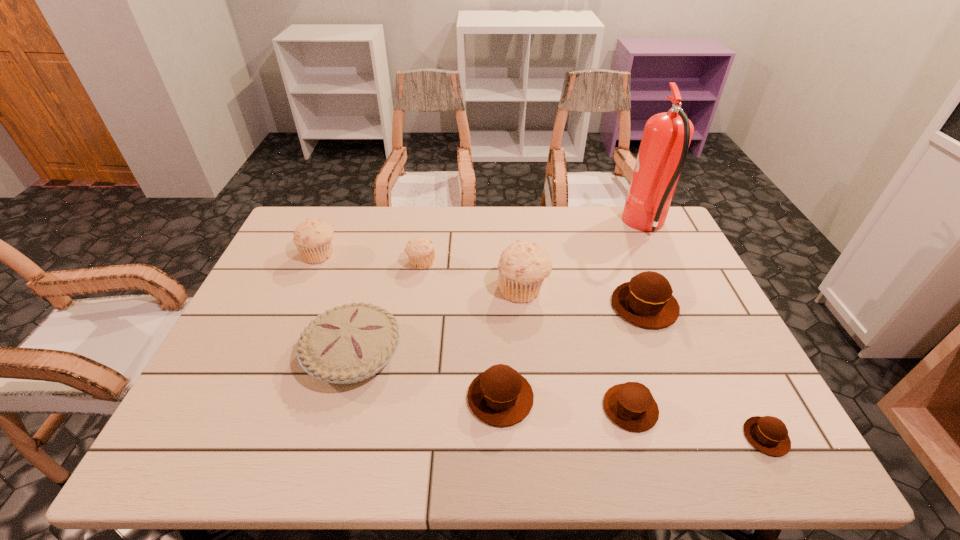
Where is `object present at the far left corner`? object present at the far left corner is located at coordinates (313, 238).

Where is `object that is positioned at the far right corner`? object that is positioned at the far right corner is located at coordinates (666, 138).

Where is `object positioned at the near right corner`? The height and width of the screenshot is (540, 960). object positioned at the near right corner is located at coordinates (768, 434).

In the image, there is a desktop. Where is `vacant space at the far edge`? The height and width of the screenshot is (540, 960). vacant space at the far edge is located at coordinates (581, 225).

In the image, there is a desktop. Identify the location of vacant space at the left edge. The width and height of the screenshot is (960, 540). pos(247,403).

Locate an element on the screen. blank space at the right edge of the desktop is located at coordinates coord(708,328).

I want to click on free space at the far left corner of the desktop, so click(309, 215).

Where is `free location at the near left corner of the desktop`? This screenshot has width=960, height=540. free location at the near left corner of the desktop is located at coordinates (184, 457).

Where is `free space that is in between the farthest brown muffin and the second shortest muffin`? This screenshot has width=960, height=540. free space that is in between the farthest brown muffin and the second shortest muffin is located at coordinates tap(637, 357).

I want to click on free space that is in between the second smallest brown muffin and the leftmost brown muffin, so click(x=565, y=403).